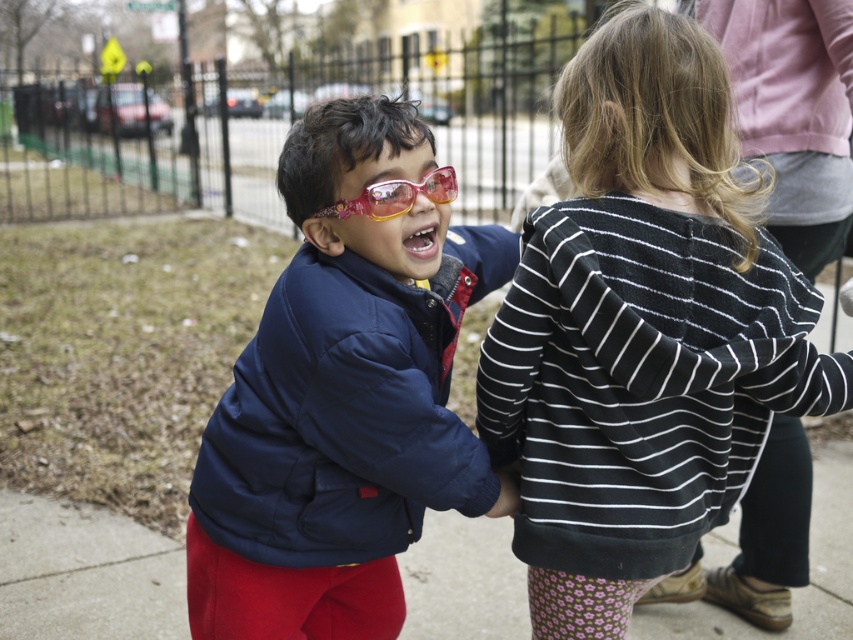
From the picture: Does matte blue jacket at center appear over pink plastic goggles at center?

Actually, matte blue jacket at center is below pink plastic goggles at center.

Does point (340, 275) come behind point (332, 209)?

Yes, point (340, 275) is farther from viewer.

Locate an element on the screen. Image resolution: width=853 pixels, height=640 pixels. matte blue jacket at center is located at coordinates click(x=341, y=397).

Which of these two, black striped hoodie at center or matte blue jacket at center, stands shorter?

matte blue jacket at center

Is point (549, 557) positioned after point (318, 365)?

Yes, point (549, 557) is behind point (318, 365).

Locate an element on the screen. The height and width of the screenshot is (640, 853). black striped hoodie at center is located at coordinates (642, 330).

Can you confirm if black striped hoodie at center is taller than pink plastic goggles at center?

Indeed, black striped hoodie at center has a greater height compared to pink plastic goggles at center.

Who is more forward, (711,307) or (374,214)?

Positioned in front is point (374,214).

You are a GUI agent. You are given a task and a screenshot of the screen. Output one action in this format:
    pyautogui.click(x=<x>, y=<y>)
    Task: Click on the black striped hoodie at center
    The width and height of the screenshot is (853, 640).
    Given the screenshot: What is the action you would take?
    pyautogui.click(x=642, y=330)